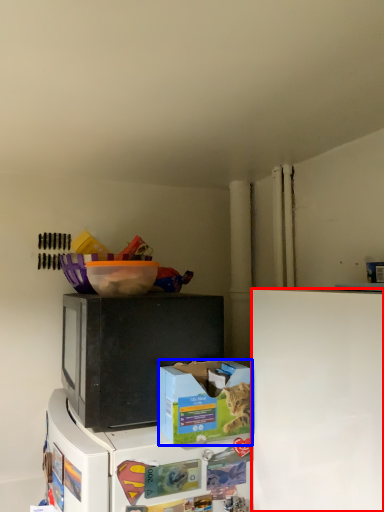
Question: Which object appears farthest to the camera in this image, refrigerator (highlighted by a red box) or box (highlighted by a blue box)?

Choices:
 (A) refrigerator
 (B) box

Answer: (B)